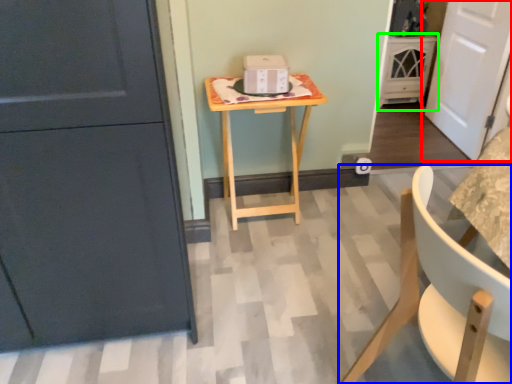
Question: Based on their relative distances, which object is nearer to door (highlighted by a red box)? Choose from chair (highlighted by a blue box) and cabinetry (highlighted by a green box).

Choices:
 (A) chair
 (B) cabinetry

Answer: (B)